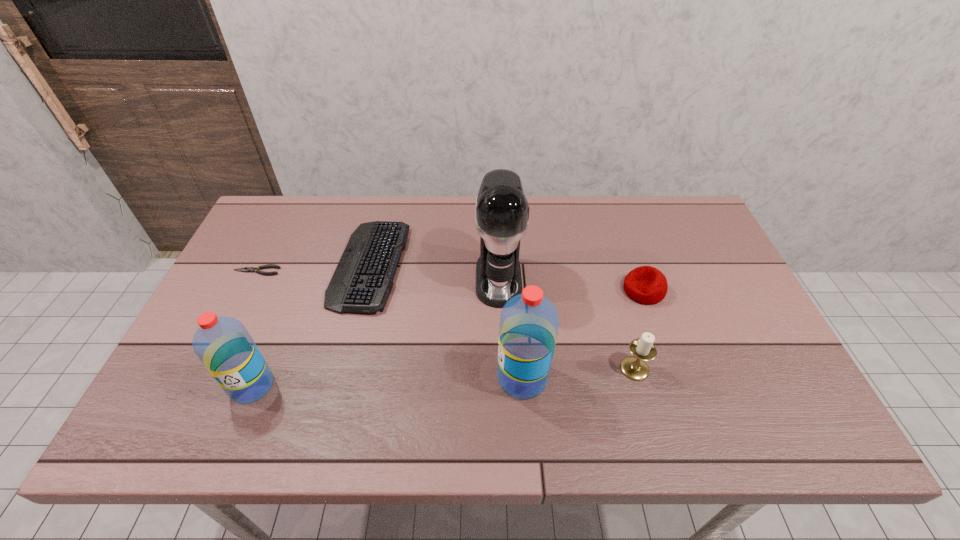
Locate an element on the screen. vacant point located 0.290m on the front label of the taller water bottle is located at coordinates (374, 378).

The image size is (960, 540). Identify the location of vacant space situated on the front label of the taller water bottle. [x=412, y=378].

Where is `free region located 0.180m on the front label of the taller water bottle`? The height and width of the screenshot is (540, 960). free region located 0.180m on the front label of the taller water bottle is located at coordinates (420, 378).

Where is `vacant region located 0.300m on the seat area of the beanbag`? vacant region located 0.300m on the seat area of the beanbag is located at coordinates click(516, 291).

I want to click on vacant space situated 0.320m on the seat area of the beanbag, so click(509, 291).

Locate an element on the screen. Image resolution: width=960 pixels, height=540 pixels. vacant space situated on the seat area of the beanbag is located at coordinates pos(541,291).

The width and height of the screenshot is (960, 540). I want to click on free region located on the back of the pliers, so click(x=283, y=218).

Where is `blank space located 0.150m on the back of the second shortest object`? This screenshot has height=540, width=960. blank space located 0.150m on the back of the second shortest object is located at coordinates (387, 197).

At what (x,y) coordinates should I click in order to perform the action: click on vacant region located place cup under the spout of the coffee maker. Please return your answer as a coordinate pair (x, y). The image size is (960, 540). Looking at the image, I should click on (501, 332).

This screenshot has height=540, width=960. What are the coordinates of `vacant area situated on the left of the fourth tallest object` in the screenshot? It's located at (529, 369).